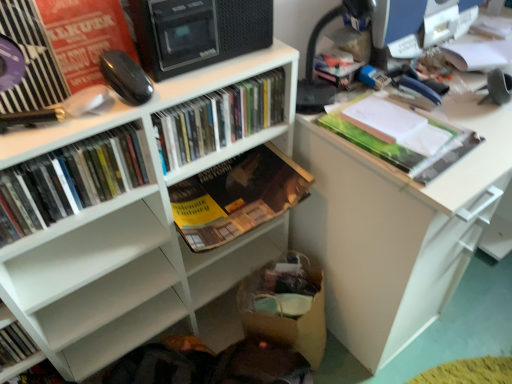
I want to click on empty space that is ontop of green matte folder at upper right, the 1th book positioned from the right (from a real-world perspective), so click(x=390, y=121).